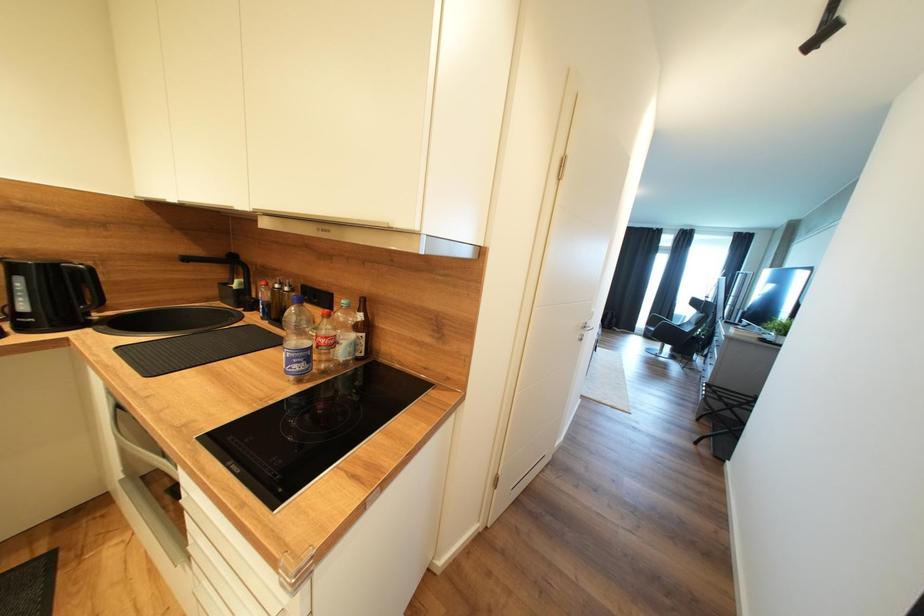
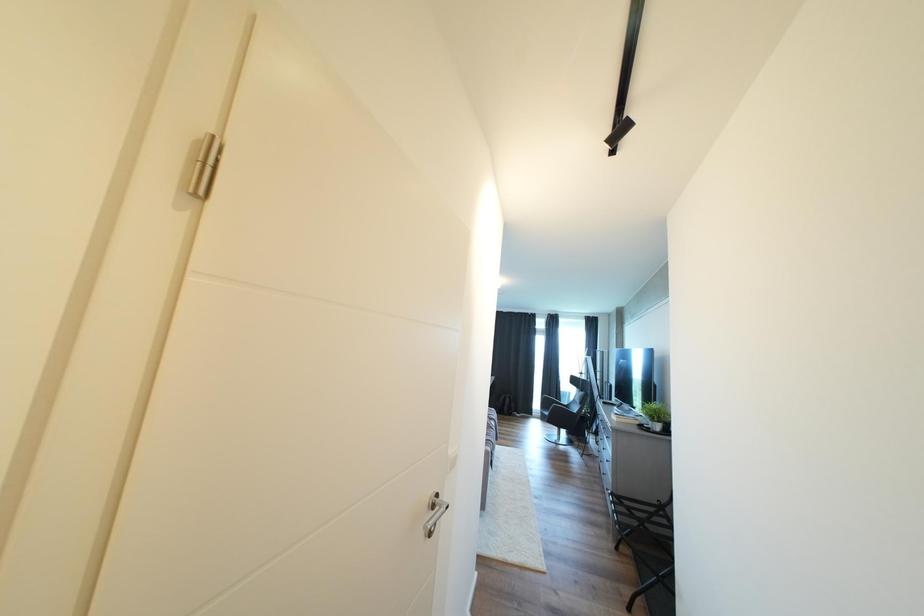
The images are taken continuously from a first-person perspective. In which direction are you moving?

The cameraman walked toward right, forward.